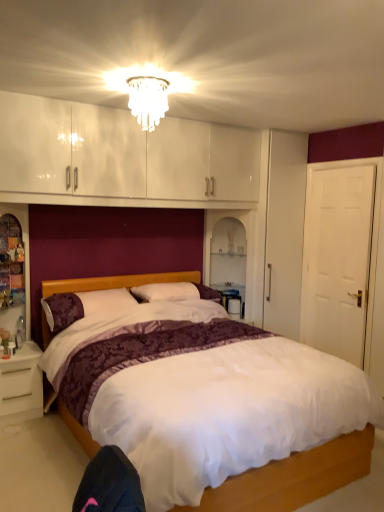
The height and width of the screenshot is (512, 384). I want to click on free space above translucent glass chandelier at upper center (from a real-world perspective), so click(x=149, y=82).